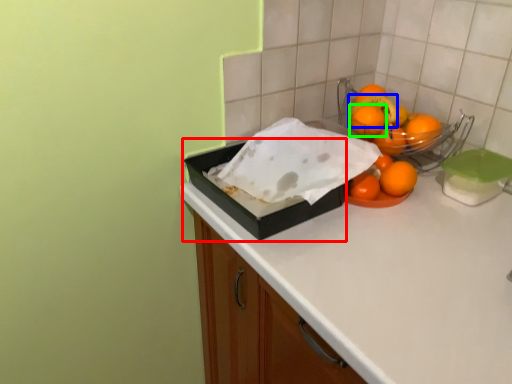
Question: Considering the real-world distances, which object is farthest from box (highlighted by a red box)? fruit (highlighted by a blue box) or orange (highlighted by a green box)?

Choices:
 (A) fruit
 (B) orange

Answer: (A)